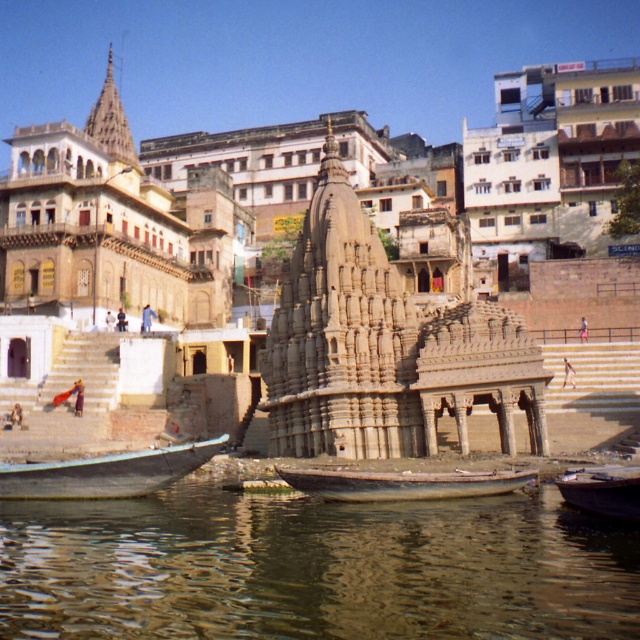
Does blue wooden boat at lower left appear on the left side of wooden boat at lower right?

Yes, blue wooden boat at lower left is to the left of wooden boat at lower right.

Does blue wooden boat at lower left have a larger size compared to wooden boat at lower right?

Answer: Yes.

Find the location of a particular element. Image resolution: width=640 pixels, height=640 pixels. blue wooden boat at lower left is located at coordinates (106, 472).

Does greenish water at lower center appear over wooden boat at center?

No, greenish water at lower center is not above wooden boat at center.

Is point (26, 602) positioned in front of point (480, 483)?

Yes, it is in front of point (480, 483).

Locate an element on the screen. greenish water at lower center is located at coordinates (314, 566).

Does point (504, 392) lie in front of point (99, 497)?

That is False.

Between point (372, 218) and point (138, 474), which one is positioned in front?

Point (138, 474) is in front.

Where is `beige stone temple at center`? The height and width of the screenshot is (640, 640). beige stone temple at center is located at coordinates (484, 305).

Where is `beige stone temple at center`? The height and width of the screenshot is (640, 640). beige stone temple at center is located at coordinates (484, 305).